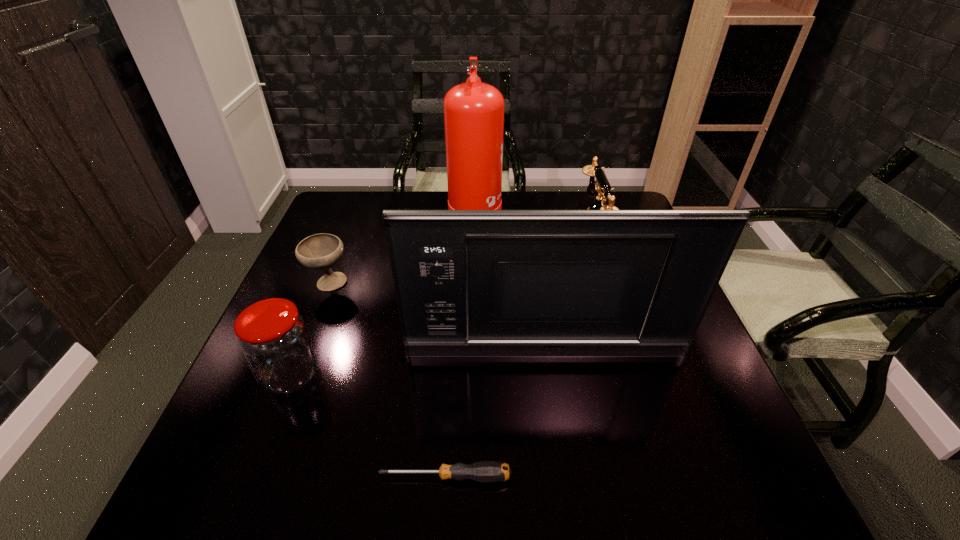
Image resolution: width=960 pixels, height=540 pixels. Identify the location of free spot between the fourth tallest object and the shortest object. (369, 426).

Find the location of a particular element. Image resolution: width=960 pixels, height=540 pixels. empty space between the tallest object and the jar is located at coordinates (383, 295).

Where is `object that is the third nearest to the tallest object`? object that is the third nearest to the tallest object is located at coordinates (468, 282).

You are a GUI agent. You are given a task and a screenshot of the screen. Output one action in this format:
    pyautogui.click(x=<x>, y=<y>)
    Task: Click on the object that ranks as the second closest to the second tallest object
    The height and width of the screenshot is (540, 960).
    Given the screenshot: What is the action you would take?
    [x=484, y=471]

What are the coordinates of `free space that satisfies the following two spatial constraints: 1. on the dial of the telephone; 2. on the front panel of the fifth shortest object` in the screenshot? It's located at (624, 356).